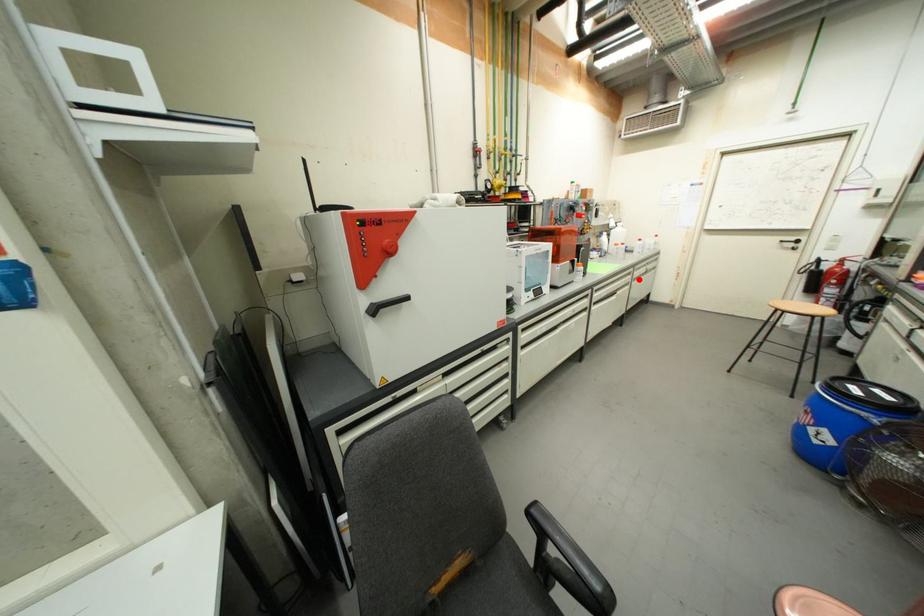
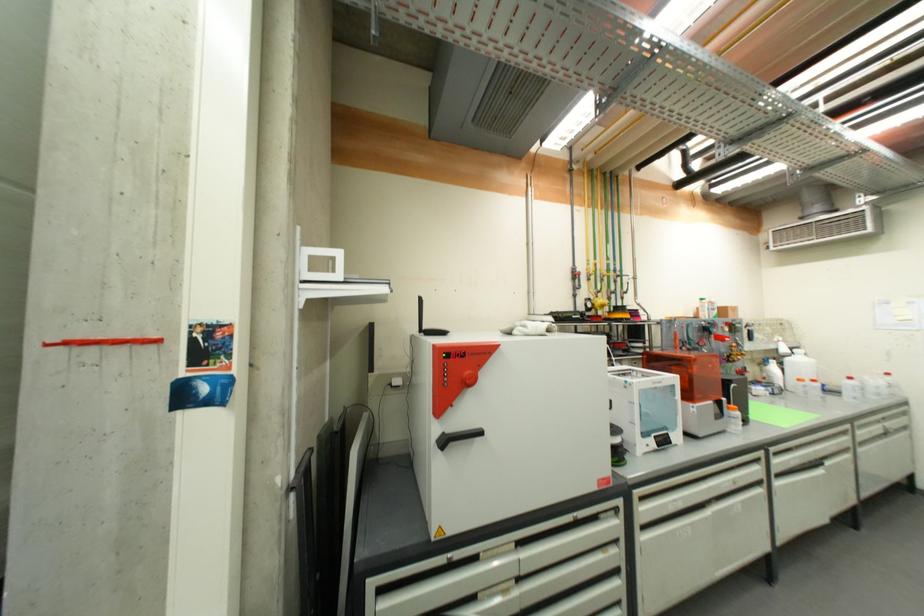
Question: I am providing you with two images of the same scene from different viewpoints. Given a red point in image1, look at the same physical point in image2. Is it:

Choices:
 (A) Closer to the viewpoint
 (B) Farther from the viewpoint

Answer: (A)